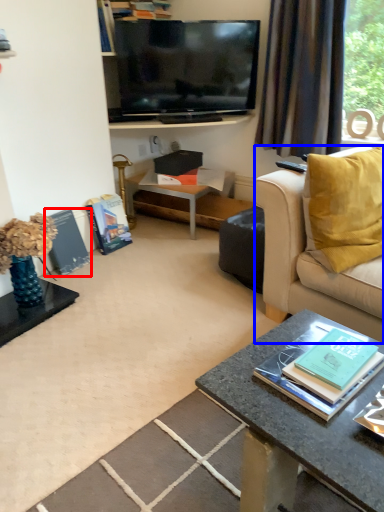
Question: Which point is further to the camera, magazine (highlighted by a red box) or studio couch (highlighted by a blue box)?

Choices:
 (A) magazine
 (B) studio couch

Answer: (A)